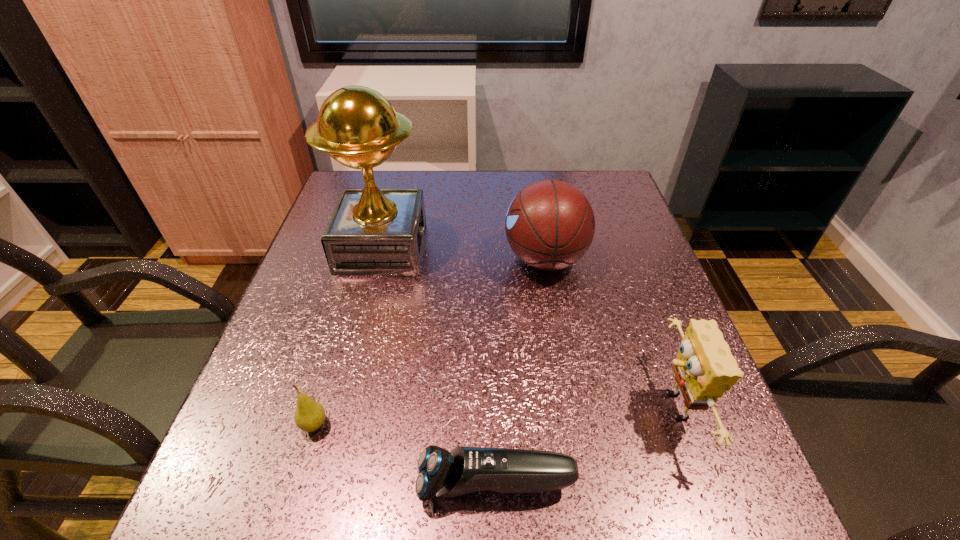
At what (x,y) coordinates should I click in order to perform the action: click on award. Please return your answer as a coordinate pair (x, y). This screenshot has width=960, height=540. Looking at the image, I should click on (372, 231).

The height and width of the screenshot is (540, 960). I want to click on basketball, so click(550, 224).

The image size is (960, 540). I want to click on the rightmost object, so click(704, 369).

Locate an element on the screen. sponge is located at coordinates (704, 369).

What are the coordinates of `the second shortest object` in the screenshot? It's located at (309, 416).

You are a GUI agent. You are given a task and a screenshot of the screen. Output one action in this format:
    pyautogui.click(x=<x>, y=<y>)
    Task: Click on the shortest object
    The height and width of the screenshot is (540, 960).
    Given the screenshot: What is the action you would take?
    pyautogui.click(x=463, y=470)

I want to click on blank area located 0.310m on the front-facing side of the tallest object, so click(549, 248).

The width and height of the screenshot is (960, 540). Find the location of `vacant space situated 0.100m on the front of the basketball`. vacant space situated 0.100m on the front of the basketball is located at coordinates (556, 323).

You are a GUI agent. You are given a task and a screenshot of the screen. Output one action in this format:
    pyautogui.click(x=<x>, y=<y>)
    Task: Click on the free point located on the face of the sponge
    
    Given the screenshot: What is the action you would take?
    pyautogui.click(x=521, y=407)

Locate an element on the screen. vacant area situated on the face of the sponge is located at coordinates (527, 407).